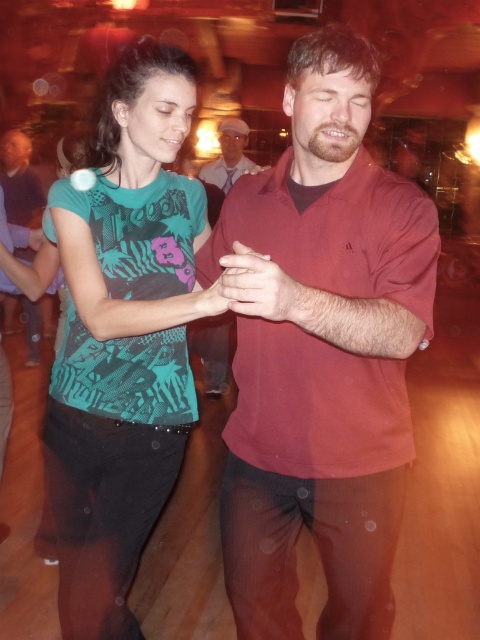
You are at a dance event and want to locate the matte red shirt at center. Based on the coordinates provided, can you confirm if the point at (321,353) is where the matte red shirt at center is located?

Yes, the point at (321,353) corresponds to the matte red shirt at center as described.

You are at a dance event and want to find the teal printed t shirt at center. The dance floor is crowded. You see a point marked at coordinate (123, 336). Is this point likely to be on the teal printed t shirt at center?

Yes, the point at coordinate (123, 336) corresponds to the teal printed t shirt at center, so it is likely on the teal printed t shirt at center.